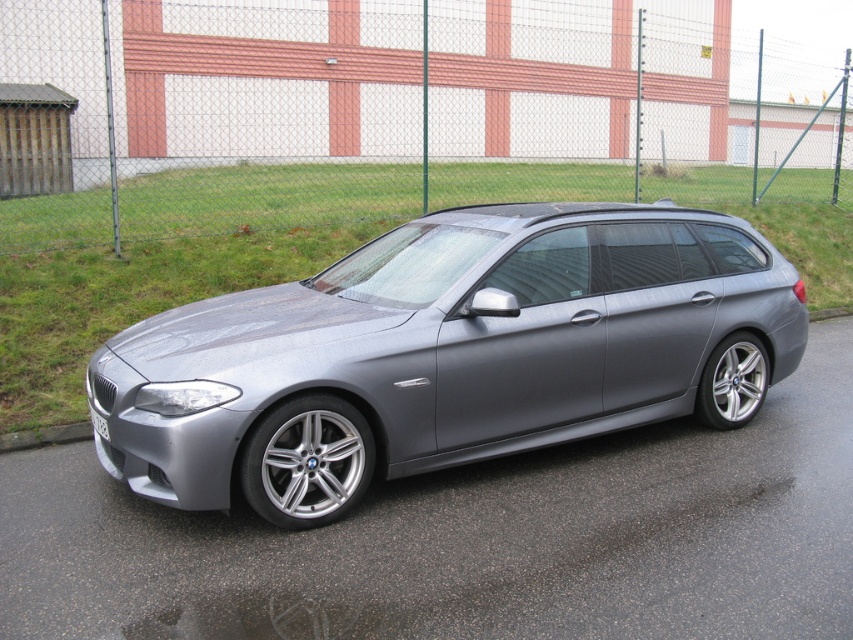
Is matte gray car at center smaller than white plastic license plate at center?

Actually, matte gray car at center might be larger than white plastic license plate at center.

Locate an element on the screen. The height and width of the screenshot is (640, 853). matte gray car at center is located at coordinates (448, 353).